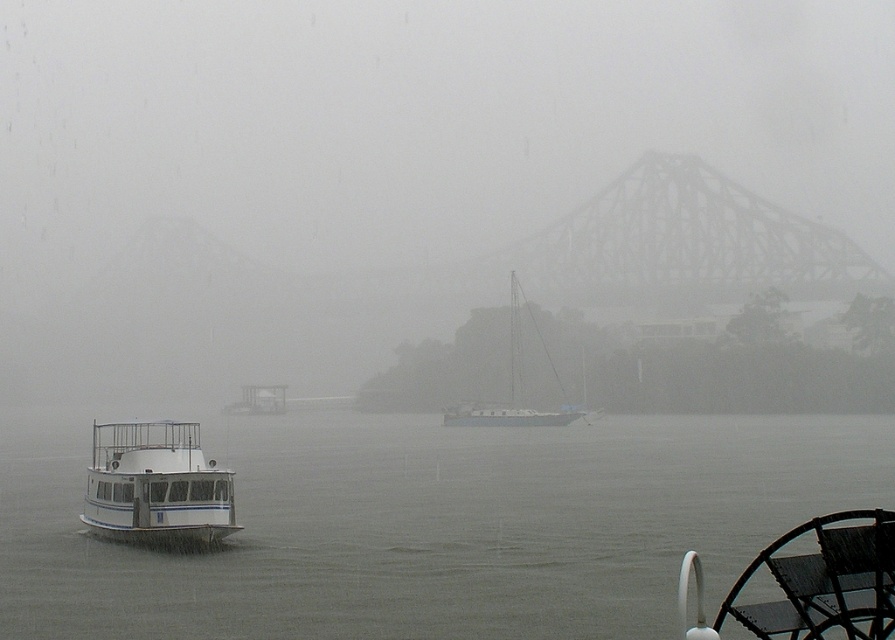
You are navigating a small boat through the foggy river scene. You see the white metal bridge at upper center. Based on its position, can you estimate how far north you need to steer to avoid hitting the bridge?

The white metal bridge at upper center is located at coordinates point (688,243), so you need to steer north to align your course away from its position.

You are standing at the origin point of the coordinate system in the image. The white glossy boat at left is represented by point [156,484]. Can you determine the direction of the boat relative to your position?

The white glossy boat at left is located at coordinates [156,484]. Since the x coordinate is greater than 0.5, it is to the right of the center point. The y coordinate is less than 0.5, so it is below the center point. Therefore, the boat is positioned to the right and slightly below the center of the image from your perspective.

You are standing at the point marked by the coordinates point (688, 243) in the foggy scene. What structure are you directly facing?

The point (688, 243) indicates the white metal bridge at upper center, so you are directly facing the white metal bridge at upper center.